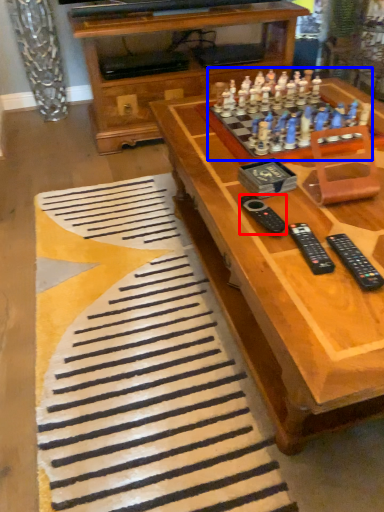
Question: Which point is closer to the camera, remote (highlighted by a red box) or game (highlighted by a blue box)?

Choices:
 (A) remote
 (B) game

Answer: (A)